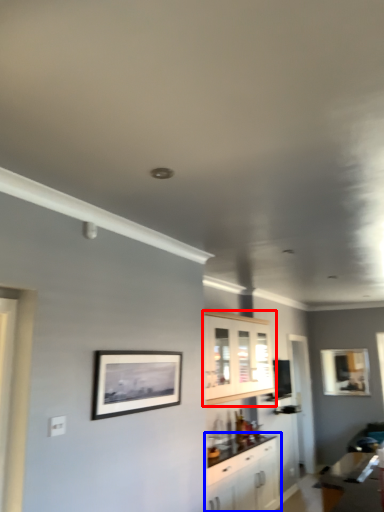
Question: Which point is closer to the camera, cabinetry (highlighted by a red box) or cabinetry (highlighted by a blue box)?

Choices:
 (A) cabinetry
 (B) cabinetry

Answer: (B)